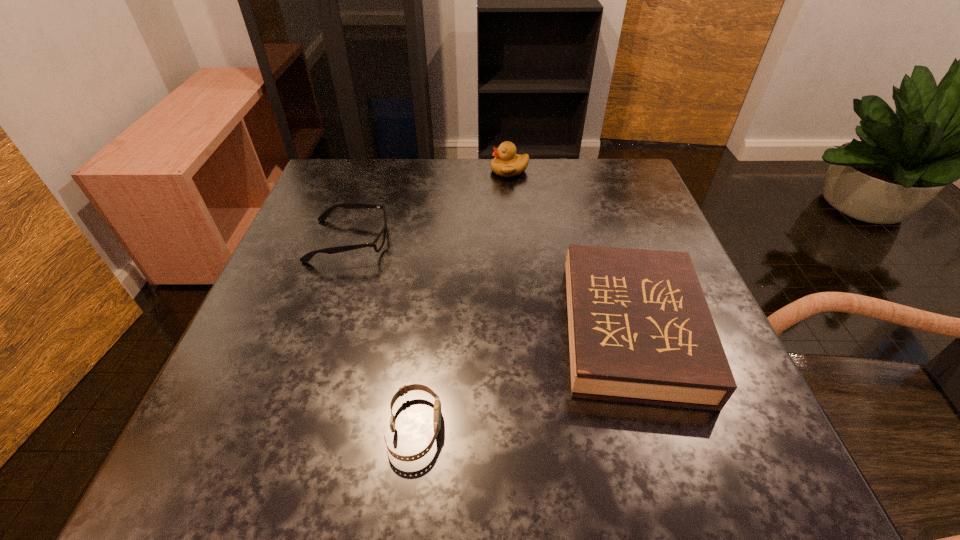
You are a GUI agent. You are given a task and a screenshot of the screen. Output one action in this format:
    pyautogui.click(x=<x>, y=<y>)
    Task: Click on the farthest object
    Image resolution: width=960 pixels, height=540 pixels.
    Given the screenshot: What is the action you would take?
    pyautogui.click(x=507, y=163)

I want to click on duckling, so click(507, 163).

Locate an element on the screen. Image resolution: width=960 pixels, height=540 pixels. the third shortest object is located at coordinates (640, 330).

Locate an element on the screen. The width and height of the screenshot is (960, 540). hardback book is located at coordinates (640, 330).

Locate an element on the screen. the leftmost object is located at coordinates (378, 243).

Where is `the second farthest object`? The width and height of the screenshot is (960, 540). the second farthest object is located at coordinates (378, 243).

I want to click on the third object from right to left, so click(x=437, y=404).

Find the location of a particular element. The image size is (960, 540). vacant space situated 0.400m at the beak of the third object from left to right is located at coordinates (338, 171).

I want to click on vacant space located at the beak of the third object from left to right, so click(x=429, y=171).

At what (x,y) coordinates should I click in order to perform the action: click on vacant space located 0.170m at the beak of the third object from left to right. Please return your answer as a coordinate pair (x, y). This screenshot has width=960, height=540. Looking at the image, I should click on (425, 171).